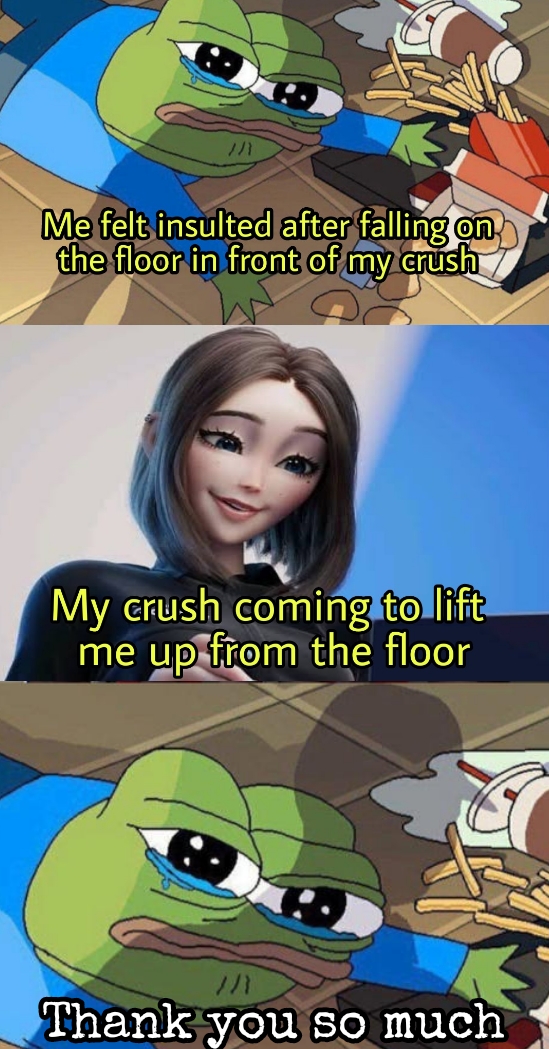
I want to click on laptop, so click(483, 629).